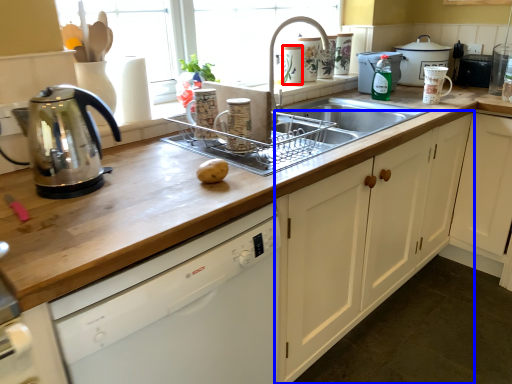
Question: Which object is closer to the camera taking this photo, appliance (highlighted by a red box) or cabinetry (highlighted by a blue box)?

Choices:
 (A) appliance
 (B) cabinetry

Answer: (B)